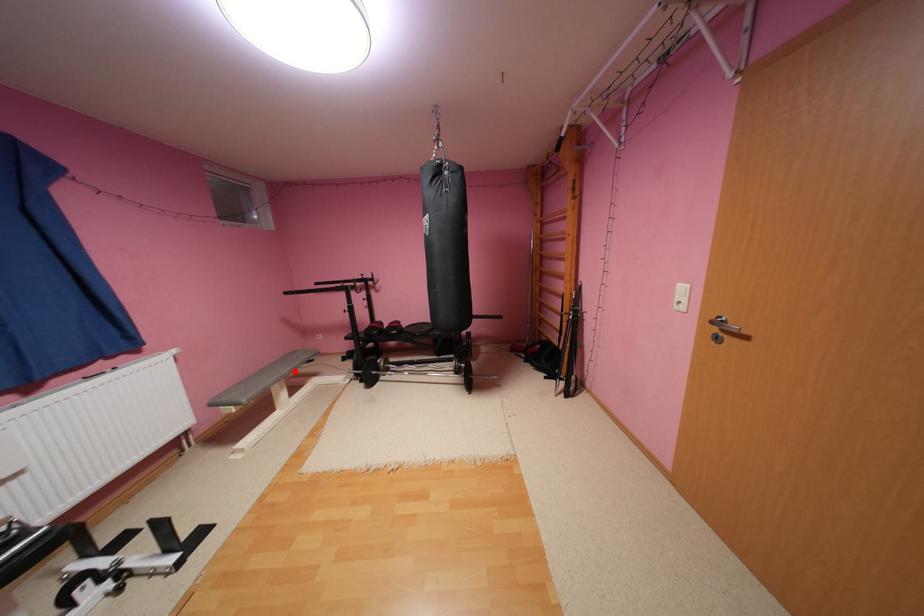
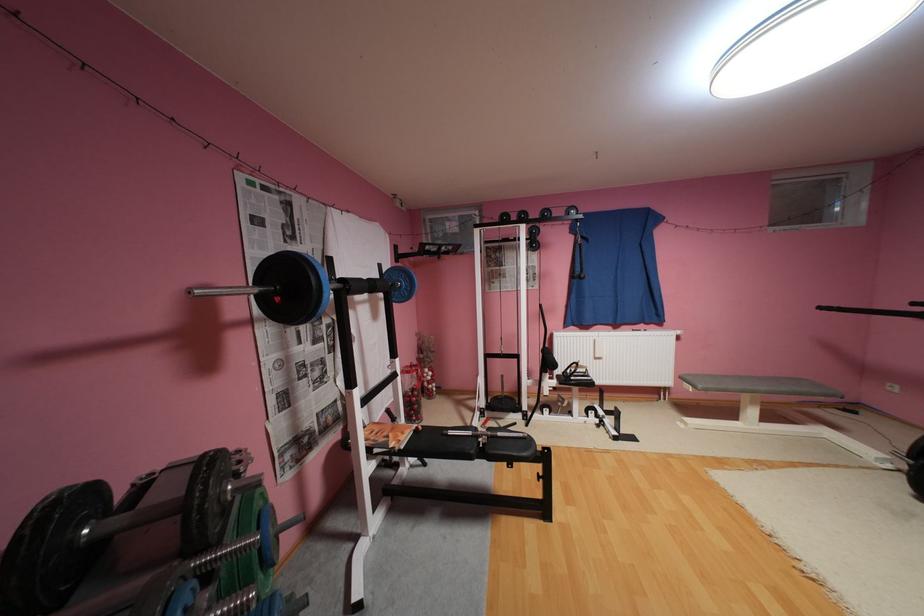
In the second image, find the point that corresponds to the highlighted location in the first image.

(771, 387)